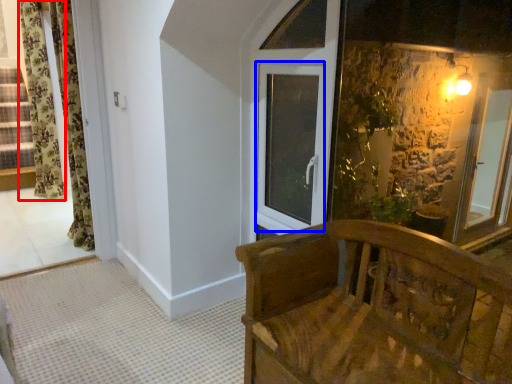
Question: Which point is closer to the camera, curtain (highlighted by a red box) or window (highlighted by a blue box)?

Choices:
 (A) curtain
 (B) window

Answer: (B)